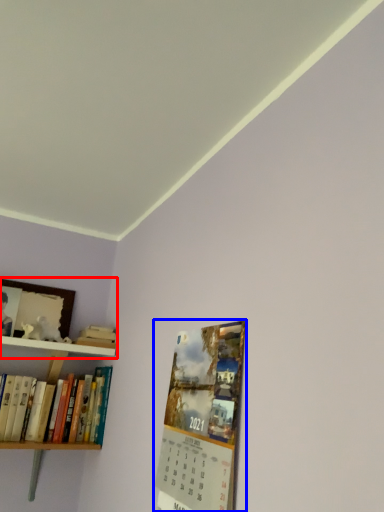
Question: Which object is further to the camera taking this photo, shelf (highlighted by a red box) or magazine (highlighted by a blue box)?

Choices:
 (A) shelf
 (B) magazine

Answer: (A)